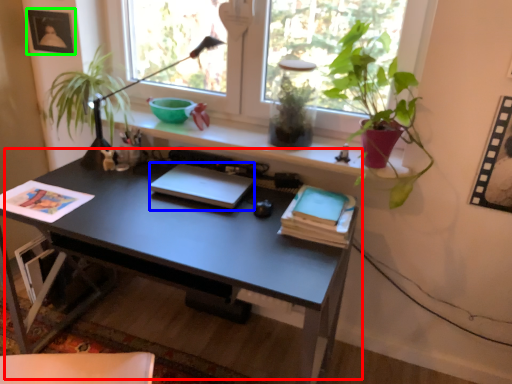
Question: Based on their relative distances, which object is farther from desk (highlighted by a red box)? Choose from laptop (highlighted by a blue box) and picture frame (highlighted by a green box).

Choices:
 (A) laptop
 (B) picture frame

Answer: (B)